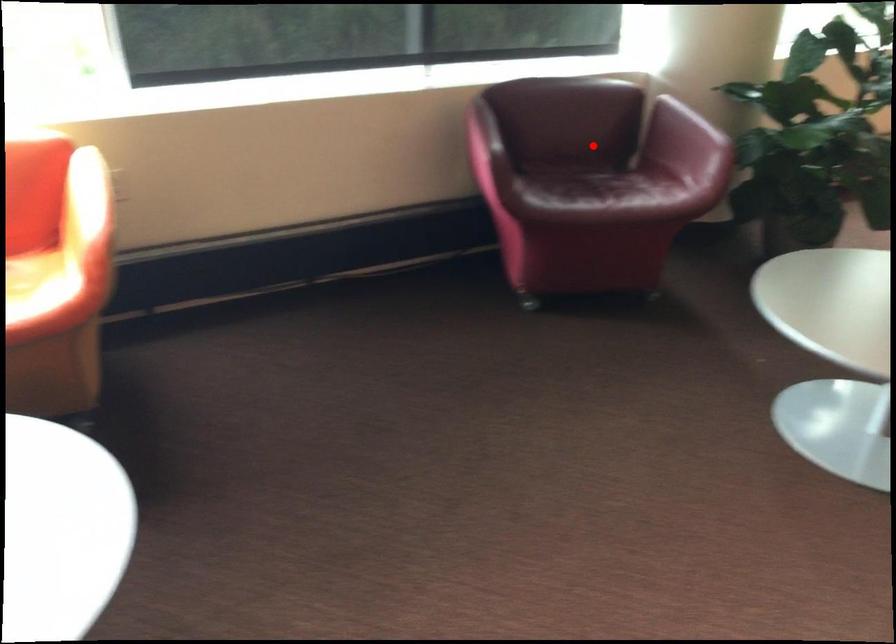
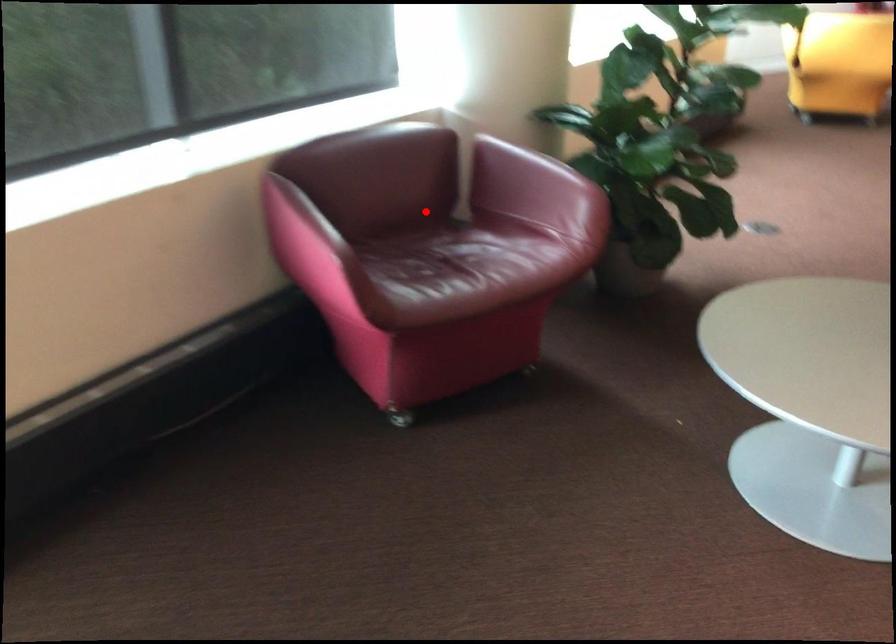
I am providing you with two images of the same scene from different viewpoints. A red point is marked on the first image and another point is marked on the second image. Are the points marked in image1 and image2 representing the same 3D position?

Yes